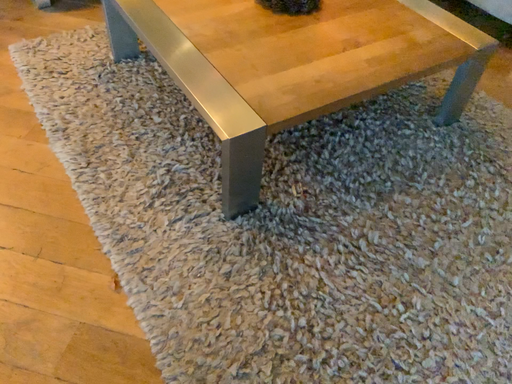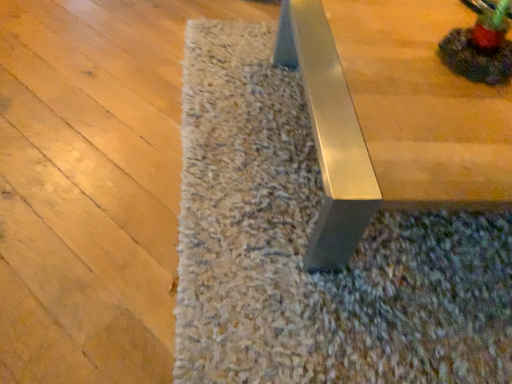
Question: How did the camera likely rotate when shooting the video?

Choices:
 (A) rotated left
 (B) rotated right

Answer: (A)